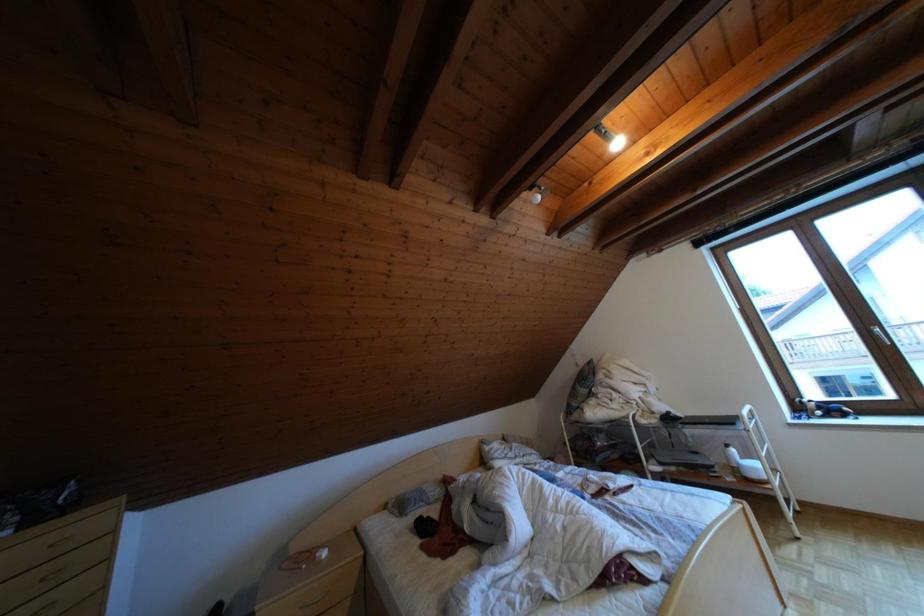
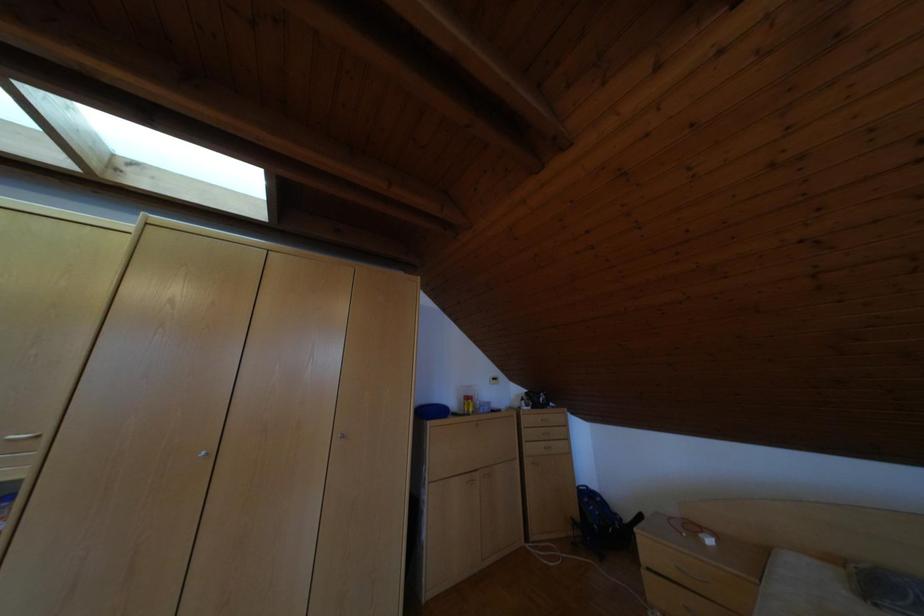
Question: How did the camera likely rotate?

Choices:
 (A) Left
 (B) Right
 (C) Up
 (D) Down

Answer: (A)